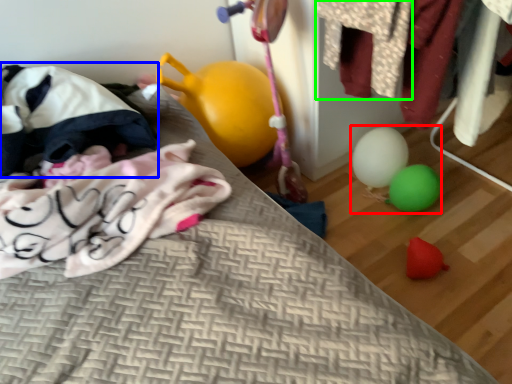
Question: Which object is positioned farthest from toy (highlighted by a red box)? Select from bean bag chair (highlighted by a blue box) and clothing (highlighted by a green box).

Choices:
 (A) bean bag chair
 (B) clothing

Answer: (A)